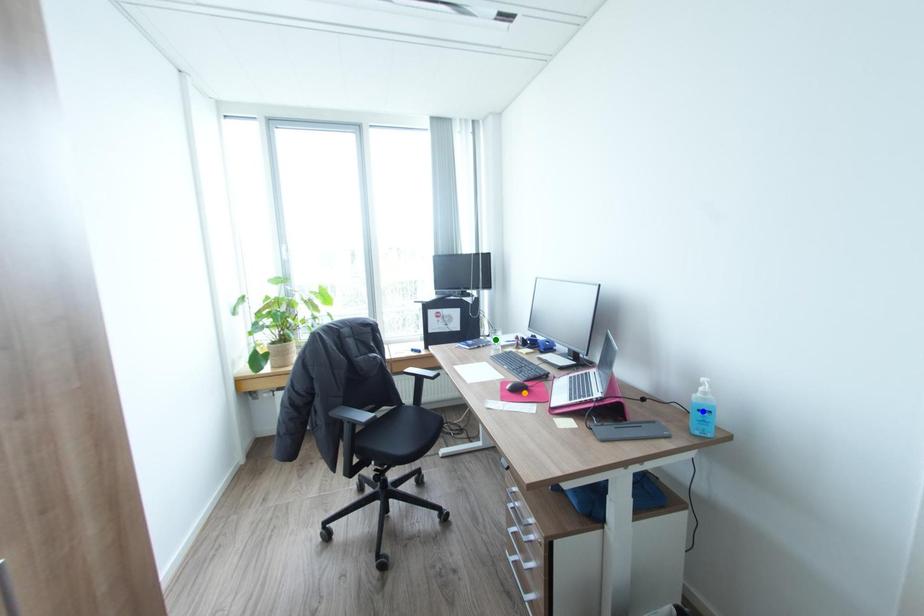
Order these from nearest to farthest:
- green point
- orange point
- blue point

1. blue point
2. orange point
3. green point